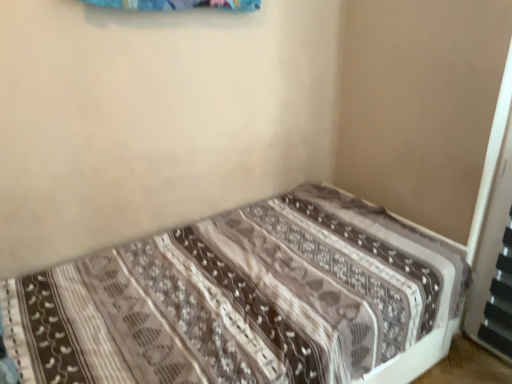
This screenshot has height=384, width=512. What do you see at coordinates (245, 301) in the screenshot?
I see `brown textured blanket at lower right` at bounding box center [245, 301].

At what (x,y) coordinates should I click in order to perform the action: click on brown textured blanket at lower right. Please return your answer as a coordinate pair (x, y). Image resolution: width=512 pixels, height=384 pixels. Looking at the image, I should click on (245, 301).

This screenshot has width=512, height=384. In order to click on brown textured blanket at lower right in this screenshot , I will do `click(245, 301)`.